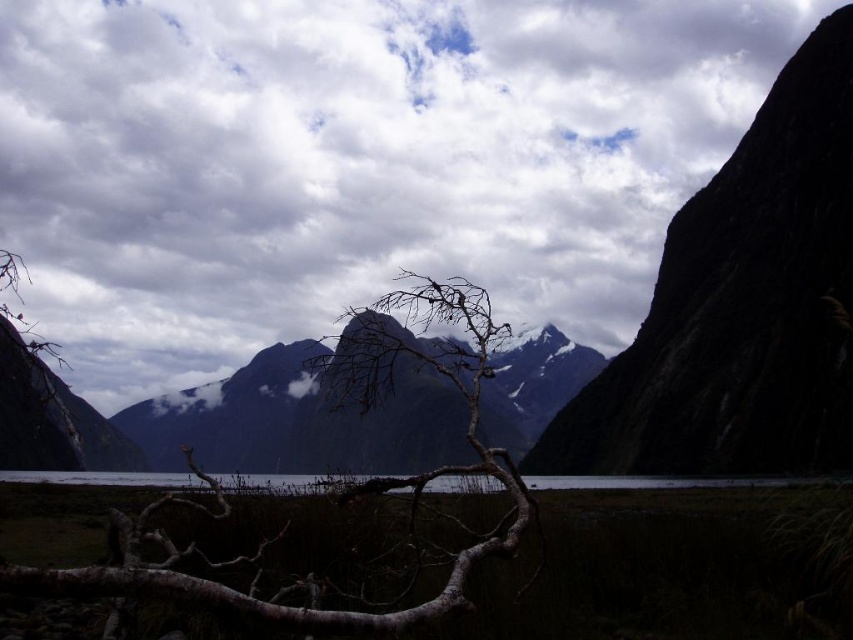
Based on the scene described, which object, the dark gray rocky mountain at center or the clear water at center, occupies a higher position in the landscape?

The dark gray rocky mountain at center has a greater height compared to the clear water at center, so it occupies a higher position in the landscape.

You are an artist planning to paint this scene. You want to ensure the brown rough tree at center and the clear water at center are proportionally accurate. Which object should you make thinner in your painting?

The brown rough tree at center should be made thinner than the clear water at center in the painting to maintain proportional accuracy.

Based on the scene description, which object occupies a larger area in the image? Please choose between the dark gray rocky mountain at center and the clear water at center.

The dark gray rocky mountain at center has a larger size compared to the clear water at center, so it occupies a larger area in the image.